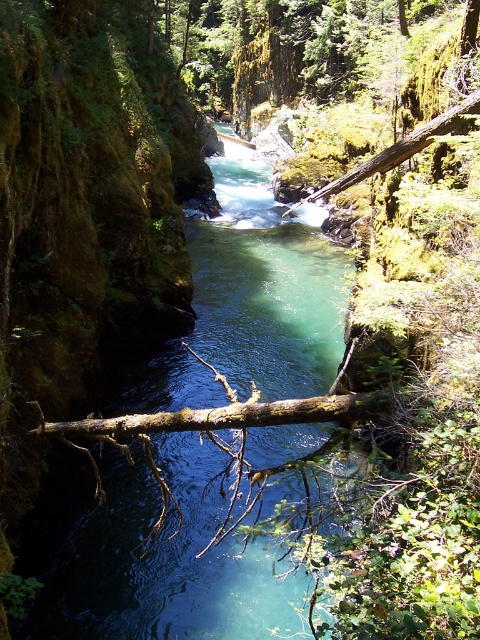
You are a hiker crossing the narrow canyon and need to step on the brown rough log at center to avoid the clear water at center. Given that your hiking boots have a grip suitable for rough surfaces, which object would provide a safer footing? Explain your reasoning based on the scene description.

The brown rough log at center provides safer footing because its rough surface offers better traction compared to the clear water at center, which is likely slippery and moving due to the swift current mentioned in the scene.

You are standing at the edge of the canyon and want to cross the river using the brown rough log at center. The clear water at center is flowing over it. Is the log fully submerged in the water or partially visible above the water?

The clear water at center is above brown rough log at center, meaning the log is partially visible above the water since the water flows over it.